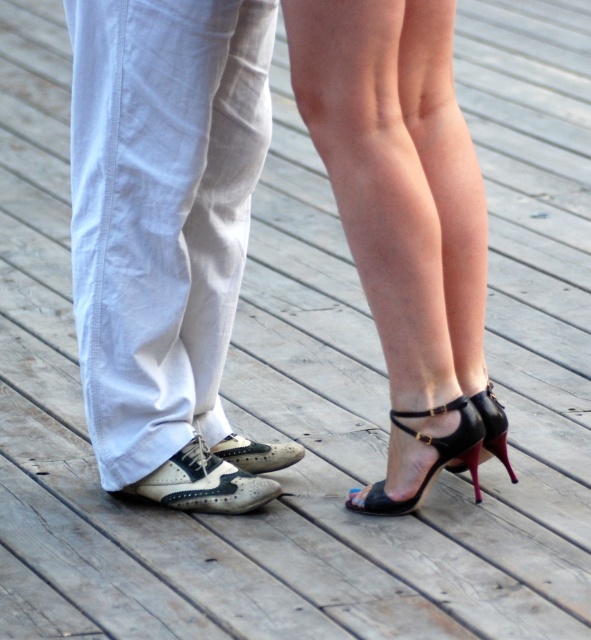
You are trying to decide which shoe to wear for a casual walk. Based on the image, which shoe has a larger size between the black leather sandal at lower right and the leather brogue shoe at center?

The black leather sandal at lower right has a larger size compared to the leather brogue shoe at center.

You are standing on a wooden deck and see the black leather sandal at lower right and the leather brogue shoe at center. Which shoe is more to the right?

The black leather sandal at lower right is more to the right than the leather brogue shoe at center.

You are trying to decide which pair of high heels to wear for an outdoor event. You see the black patent leather high heels at center and the black leather high heels at center in the image. Which pair is taller?

The black patent leather high heels at center is taller than the black leather high heels at center.